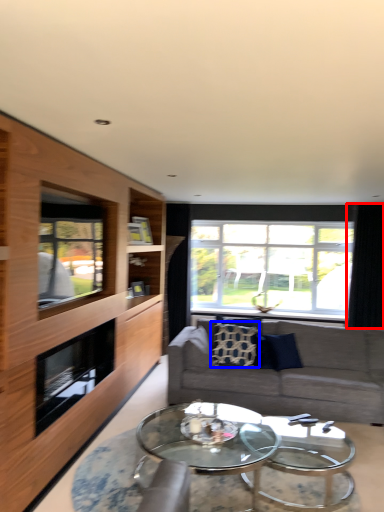
Question: Which of the following is the farthest to the observer, curtain (highlighted by a red box) or pillow (highlighted by a blue box)?

Choices:
 (A) curtain
 (B) pillow

Answer: (A)